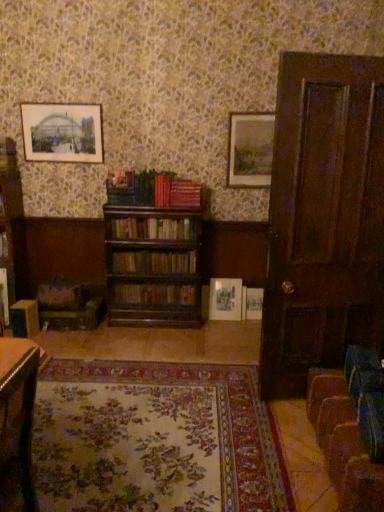
This screenshot has height=512, width=384. Find the location of `empty space that is ontop of floral carpet at center (from a real-world perspective)`. empty space that is ontop of floral carpet at center (from a real-world perspective) is located at coordinates (149, 412).